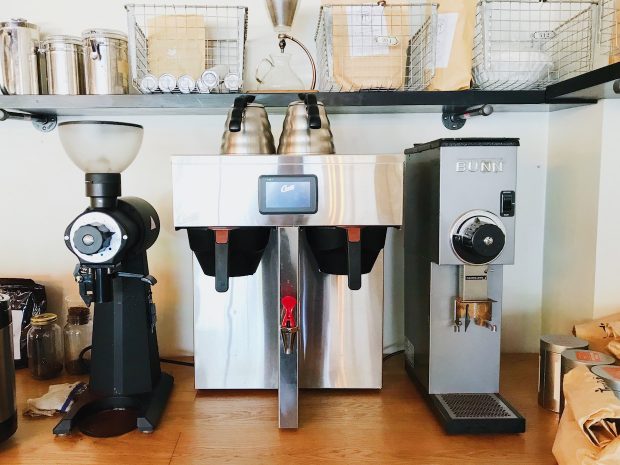
Where is `coffee filters`? This screenshot has width=620, height=465. coffee filters is located at coordinates (513, 73).